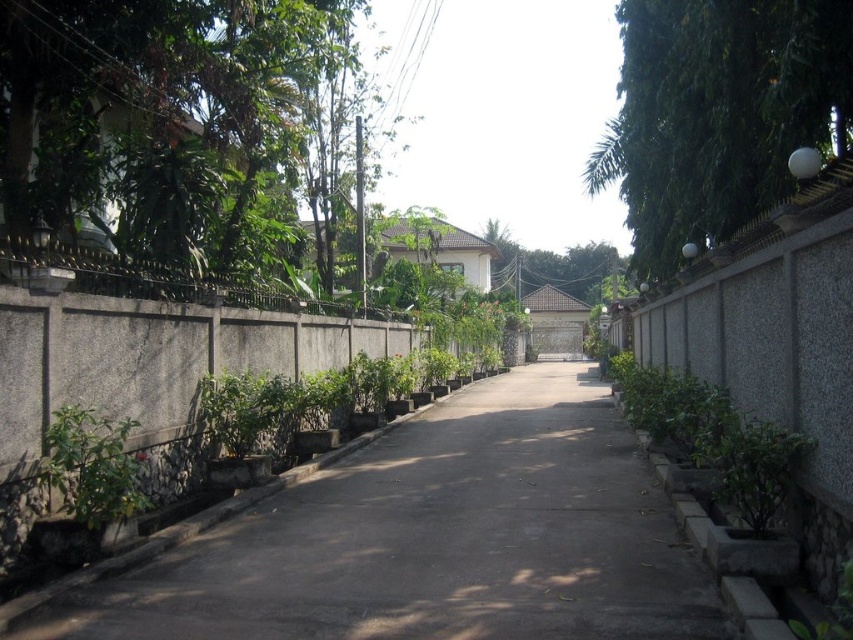
You are a delivery person carrying a large package that is 1.5 meters wide. You need to navigate through the gray concrete pavement at center and the green leafy tree at right. Can you pass through without hitting the tree?

The gray concrete pavement at center is smaller than the green leafy tree at right, so the pavement might not be wide enough for the package. You may need to adjust your path to avoid the tree.

You are walking along the narrow pathway between the high concrete walls and want to reach a specific point ahead. You are currently standing at point (225, 65). There is another point at (641, 484). Which point is closer to your current position?

Point (225, 65) is closer to your current position since you are standing there.

You are standing on the pathway depicted in the image. There is a point marked at coordinates (x=436, y=538). What is located at this point?

The point at coordinates (x=436, y=538) indicates gray concrete pavement at center.